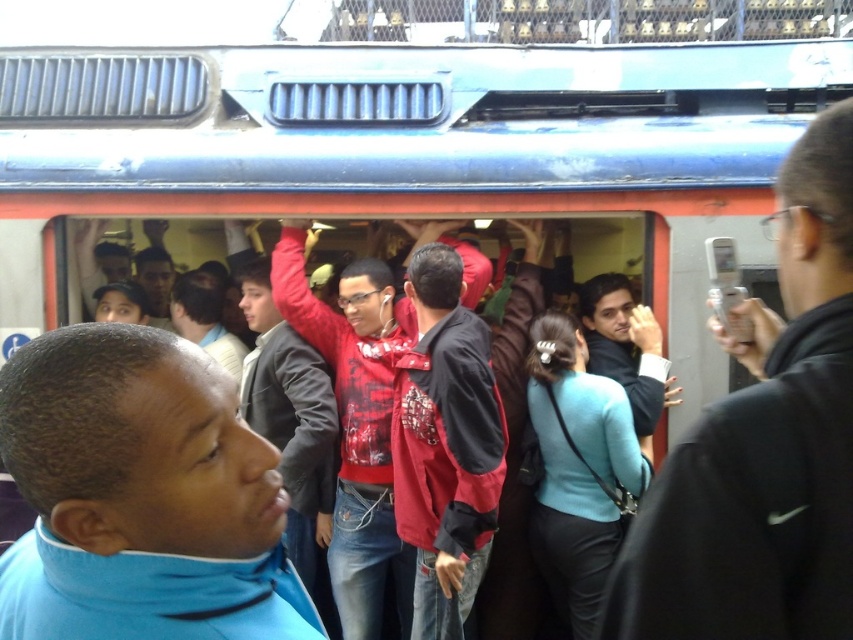
Question: Estimate the real-world distances between objects in this image. Which object is closer to the red jacket at center?

Choices:
 (A) red plaid shirt at center
 (B) red shirt at center
 (C) black leather jacket at right
 (D) teal matte sweater at center

Answer: (B)

Question: Does red jacket at center appear over red shirt at center?

Choices:
 (A) yes
 (B) no

Answer: (B)

Question: Among these points, which one is farthest from the camera?

Choices:
 (A) (412, 256)
 (B) (837, 125)
 (C) (303, 429)

Answer: (A)

Question: Considering the relative positions of blue fabric jacket at lower left and red shirt at center in the image provided, where is blue fabric jacket at lower left located with respect to red shirt at center?

Choices:
 (A) left
 (B) right

Answer: (B)

Question: Which point appears closest to the camera in this image?

Choices:
 (A) (500, 440)
 (B) (140, 474)
 (C) (234, 374)

Answer: (B)

Question: Is blue fabric jacket at lower left wider than red jacket at center?

Choices:
 (A) yes
 (B) no

Answer: (A)